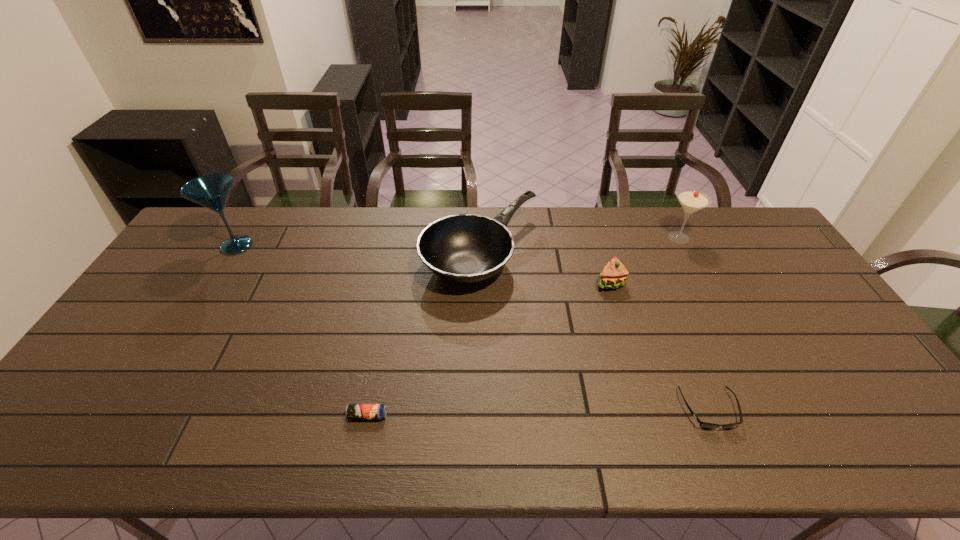
Where is `the taller martini`? The height and width of the screenshot is (540, 960). the taller martini is located at coordinates (212, 191).

What are the coordinates of `the tallest object` in the screenshot? It's located at (212, 191).

Identify the location of the shorter martini. Image resolution: width=960 pixels, height=540 pixels. (691, 200).

This screenshot has height=540, width=960. Identify the location of the second tallest object. (691, 200).

This screenshot has height=540, width=960. In order to click on the third tallest object in this screenshot , I will do `click(463, 248)`.

Identify the location of the third object from left to right. (463, 248).

Where is `the fourth tallest object`? the fourth tallest object is located at coordinates [x=614, y=274].

The height and width of the screenshot is (540, 960). Find the location of `the third object from right to left`. the third object from right to left is located at coordinates (614, 274).

This screenshot has width=960, height=540. I want to click on beer can, so (x=353, y=411).

I want to click on sunglasses, so click(705, 425).